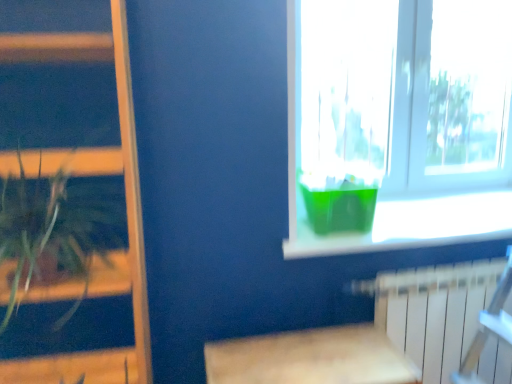
Question: Can you confirm if wooden table at lower center is taller than green plastic container at upper right?

Choices:
 (A) yes
 (B) no

Answer: (A)

Question: Would you say wooden table at lower center contains green plastic container at upper right?

Choices:
 (A) yes
 (B) no

Answer: (B)

Question: Considering the relative positions of wooden table at lower center and green plastic container at upper right in the image provided, is wooden table at lower center to the left of green plastic container at upper right from the viewer's perspective?

Choices:
 (A) no
 (B) yes

Answer: (B)

Question: Can you confirm if wooden table at lower center is wider than green plastic container at upper right?

Choices:
 (A) yes
 (B) no

Answer: (B)

Question: Considering the relative sizes of wooden table at lower center and green plastic container at upper right in the image provided, is wooden table at lower center thinner than green plastic container at upper right?

Choices:
 (A) no
 (B) yes

Answer: (B)

Question: From the image's perspective, is wooden table at lower center located above green plastic container at upper right?

Choices:
 (A) yes
 (B) no

Answer: (B)

Question: From a real-world perspective, does green translucent vase at window stand above green plastic container at upper right?

Choices:
 (A) no
 (B) yes

Answer: (B)

Question: Is green translucent vase at window facing towards green plastic container at upper right?

Choices:
 (A) no
 (B) yes

Answer: (A)

Question: Considering the relative sizes of green translucent vase at window and green plastic container at upper right in the image provided, is green translucent vase at window taller than green plastic container at upper right?

Choices:
 (A) yes
 (B) no

Answer: (A)

Question: Can you confirm if green translucent vase at window is positioned to the left of green plastic container at upper right?

Choices:
 (A) yes
 (B) no

Answer: (A)

Question: Is green translucent vase at window shorter than green plastic container at upper right?

Choices:
 (A) yes
 (B) no

Answer: (B)

Question: Is green translucent vase at window positioned before green plastic container at upper right?

Choices:
 (A) no
 (B) yes

Answer: (A)

Question: Does wooden bookshelf at left have a greater width compared to green translucent vase at window?

Choices:
 (A) no
 (B) yes

Answer: (B)